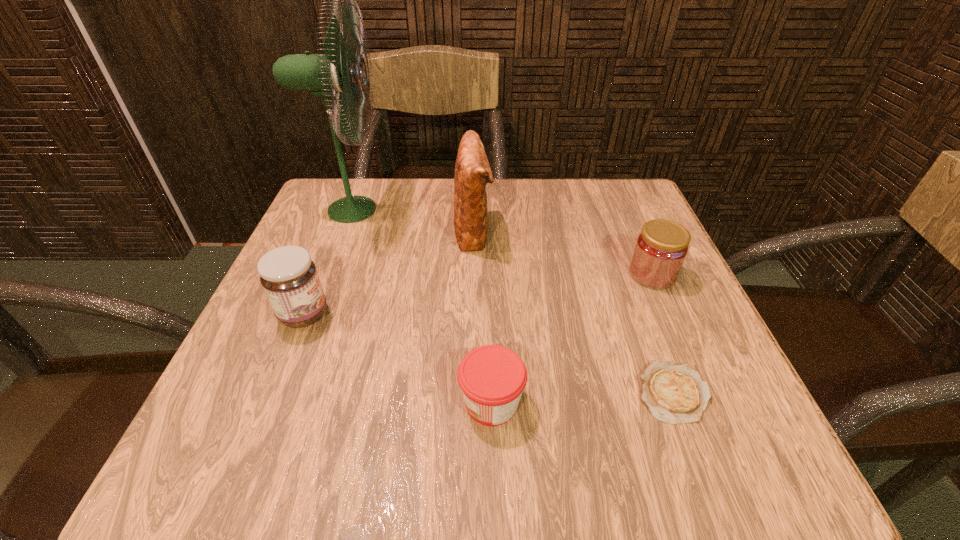
Locate an element on the screen. The height and width of the screenshot is (540, 960). fan is located at coordinates (337, 73).

Identify the location of clutch bag. This screenshot has height=540, width=960. pyautogui.click(x=472, y=171).

This screenshot has width=960, height=540. I want to click on the third tallest object, so click(x=289, y=277).

Locate an element on the screen. This screenshot has height=540, width=960. the fourth farthest object is located at coordinates pyautogui.click(x=289, y=277).

This screenshot has width=960, height=540. In order to click on the farthest jam in this screenshot , I will do `click(661, 248)`.

Identify the location of the second shortest jam. (661, 248).

Image resolution: width=960 pixels, height=540 pixels. I want to click on the second jam from left to right, so click(492, 378).

You are a GUI agent. You are given a task and a screenshot of the screen. Output one action in this format:
    pyautogui.click(x=<x>, y=<y>)
    Task: Click on the shortest jam
    This screenshot has width=960, height=540.
    Given the screenshot: What is the action you would take?
    pyautogui.click(x=492, y=378)

Find the location of a particular element. The width and height of the screenshot is (960, 540). quiche is located at coordinates (673, 393).

Identify the location of vacant region located on the front-facing side of the fan. The height and width of the screenshot is (540, 960). (444, 210).